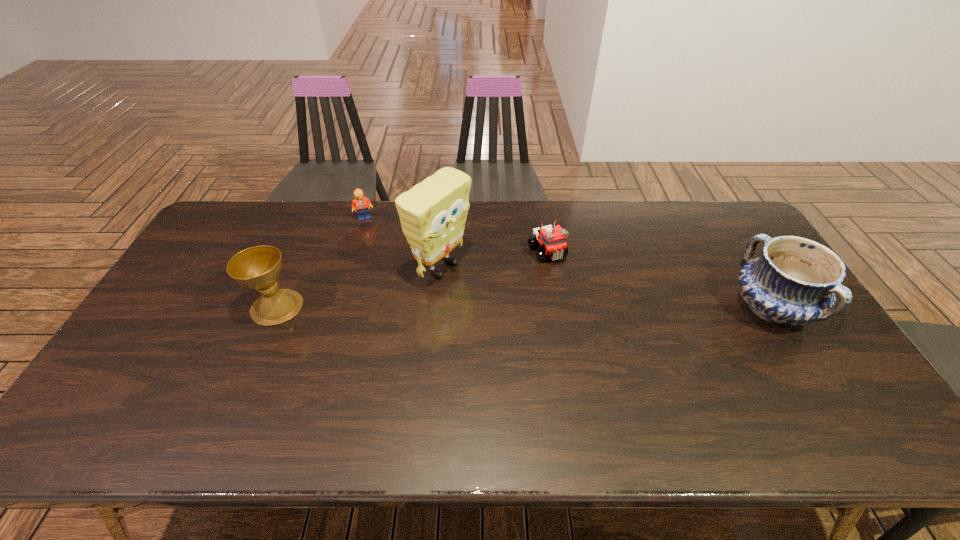
In the image, there is a desktop. At what (x,y) coordinates should I click in order to perform the action: click on vacant space at the far edge. Please return your answer as a coordinate pair (x, y). Looking at the image, I should click on (375, 217).

Find the location of a particular element. free space at the near edge of the desktop is located at coordinates (472, 393).

Identify the location of free spot at the left edge of the desktop. Image resolution: width=960 pixels, height=540 pixels. (190, 274).

This screenshot has height=540, width=960. Identify the location of vacant region at the far left corner. (258, 210).

Where is `free space at the far right corner`? free space at the far right corner is located at coordinates (750, 236).

Where is `free space at the near right corner of the desktop`? The image size is (960, 540). free space at the near right corner of the desktop is located at coordinates (803, 400).

This screenshot has height=540, width=960. I want to click on empty space between the farther Lego and the pottery, so 568,264.

Image resolution: width=960 pixels, height=540 pixels. I want to click on vacant area between the sponge and the chalice, so pyautogui.click(x=359, y=287).

Locate an element on the screen. This screenshot has width=960, height=540. vacant area that lies between the chalice and the pottery is located at coordinates (524, 308).

Where is `vacant area between the farther Lego and the chalice`? The height and width of the screenshot is (540, 960). vacant area between the farther Lego and the chalice is located at coordinates (321, 262).